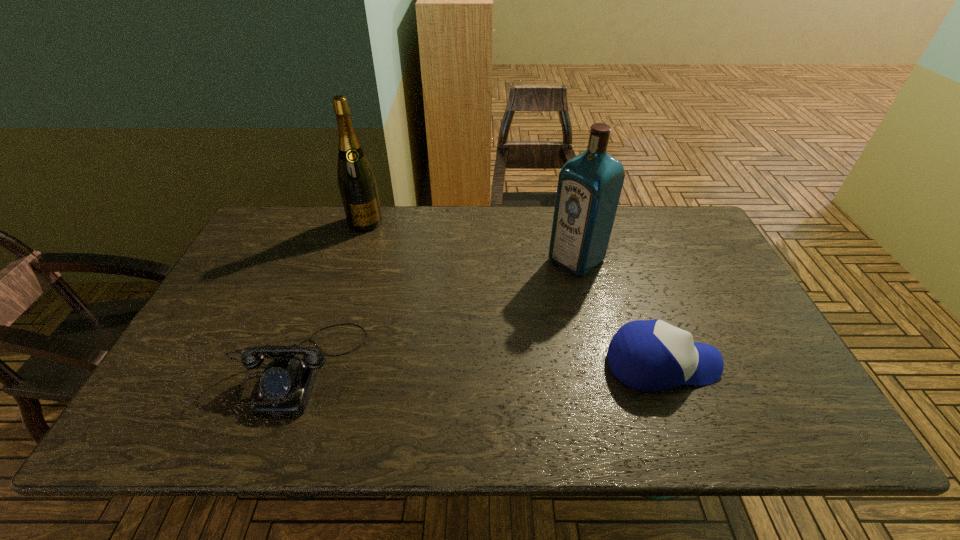
This screenshot has width=960, height=540. What are the coordinates of `free space on the desktop that is between the telephone and the baseball cap and is positioned on the flat label side of the second farthest object` in the screenshot? It's located at (438, 366).

This screenshot has height=540, width=960. Find the location of `free space on the desktop that is between the telephone and the baseball cap and is positioned on the front-facing side of the wine bottle`. free space on the desktop that is between the telephone and the baseball cap and is positioned on the front-facing side of the wine bottle is located at coordinates (430, 366).